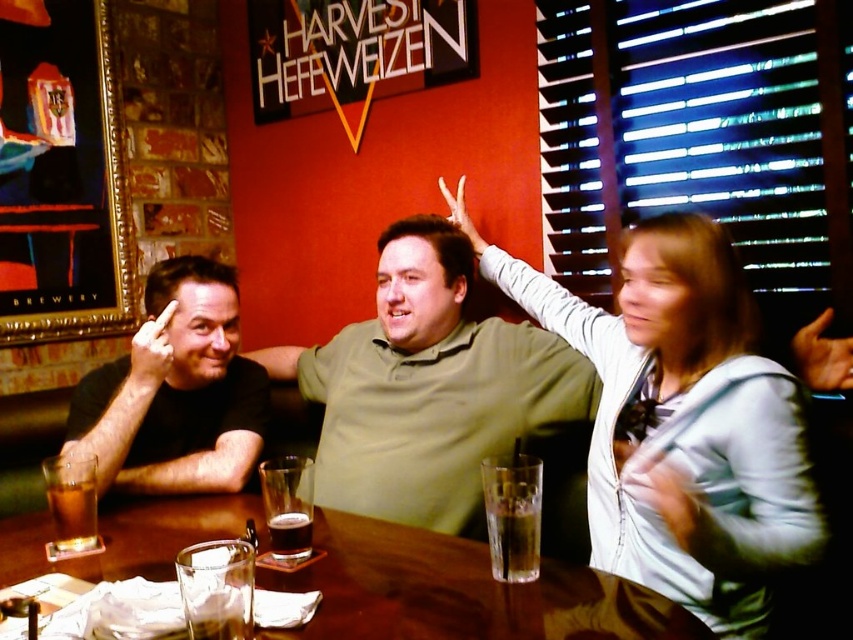
Please describe the position of the smooth skin hand at upper right in the image using the coordinate system where the origin is at the bottom left corner of the image and the coordinates are normalized between 0 and 1. What are its x and y coordinates?

The smooth skin hand at upper right is located at the coordinates x 0.558 and y 0.965 in the normalized coordinate system where the origin is at the bottom left corner of the image.

You are a server at the bar and need to deliver a drink to the customer. The customer is holding their hand out at white matte hand at upper center. There is a translucent glass at table left on the table. Which object is closer to you as you approach the table?

The translucent glass at table left is closer to the viewer than the white matte hand at upper center, so you should pick up the translucent glass at table left first as it is nearer to you.

You are a bartender trying to place a new drink order on the table. The table has limited space. You have a new drink that requires a wide base to prevent tipping. Which object on the table should you place it next to, the matte black arm at left or the dark glass at table center, and why?

You should place the new drink next to the matte black arm at left because its width is larger, providing a stable and wider base to prevent tipping compared to the dark glass at table center.